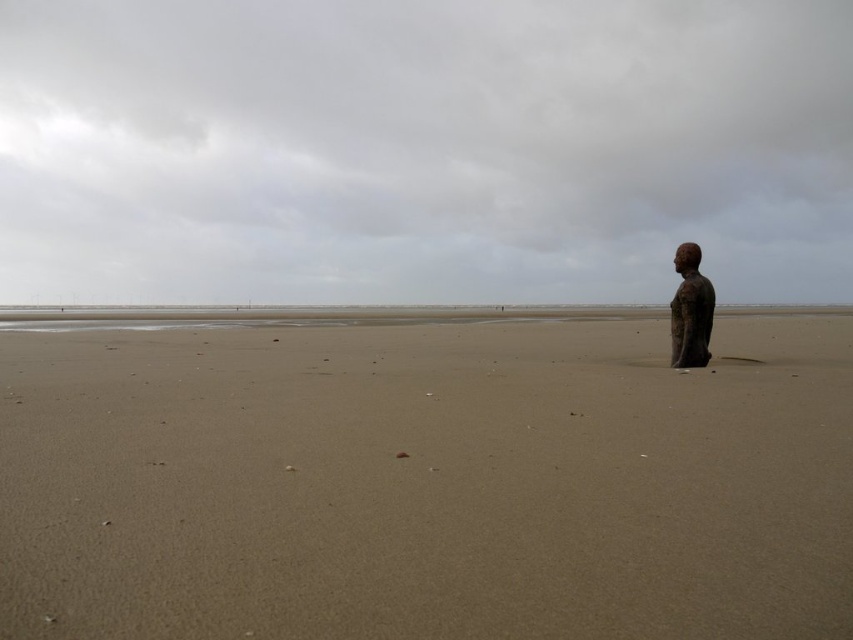
Who is more distant from viewer, (392,529) or (537,70)?

Positioned behind is point (537,70).

Can you confirm if smooth sand at lower right is bigger than matte metallic statue at right?

Incorrect, smooth sand at lower right is not larger than matte metallic statue at right.

Between point (532, 348) and point (543, 144), which one is positioned in front?

Positioned in front is point (532, 348).

The height and width of the screenshot is (640, 853). Find the location of `smooth sand at lower right`. smooth sand at lower right is located at coordinates (427, 483).

Between matte metallic statue at right and bronze statue at right, which one appears on the left side from the viewer's perspective?

From the viewer's perspective, matte metallic statue at right appears more on the left side.

Can you confirm if matte metallic statue at right is positioned below bronze statue at right?

Incorrect, matte metallic statue at right is not positioned below bronze statue at right.

Where is `matte metallic statue at right`? This screenshot has width=853, height=640. matte metallic statue at right is located at coordinates (422, 148).

What are the coordinates of `matte metallic statue at right` in the screenshot? It's located at (422, 148).

Measure the distance between smooth sand at lower right and camera.

smooth sand at lower right and camera are 1.46 meters apart.

Does point (643, 444) come closer to viewer compared to point (677, 264)?

Yes, point (643, 444) is in front of point (677, 264).

The image size is (853, 640). Find the location of `smooth sand at lower right`. smooth sand at lower right is located at coordinates (427, 483).